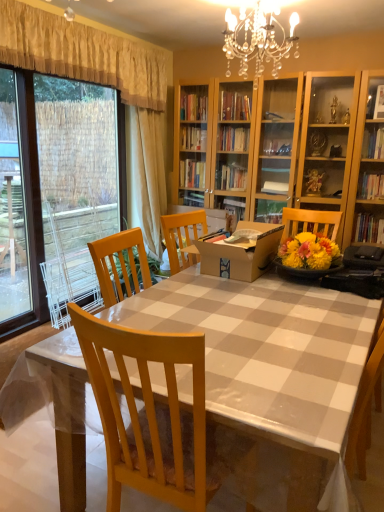
Where is `vacant space situated above white glossy table at center (from a real-world perspective)`? The image size is (384, 512). vacant space situated above white glossy table at center (from a real-world perspective) is located at coordinates (250, 310).